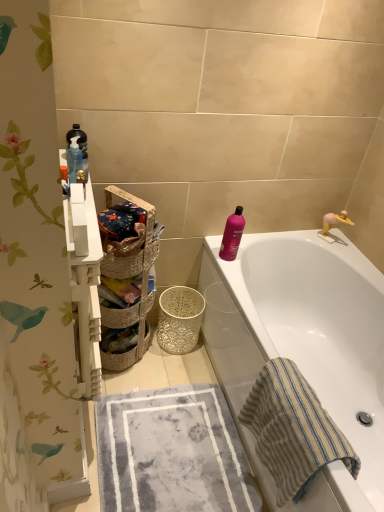
Identify the location of free space above gray textured towel at lower center, which is the 1th beach towel in left-to-right order (from a real-world perspective). This screenshot has width=384, height=512. (183, 451).